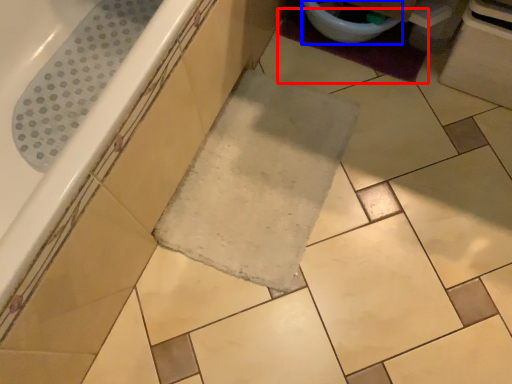
Question: Which point is closer to the camera, bath mat (highlighted by a red box) or toilet bowl (highlighted by a blue box)?

Choices:
 (A) bath mat
 (B) toilet bowl

Answer: (B)